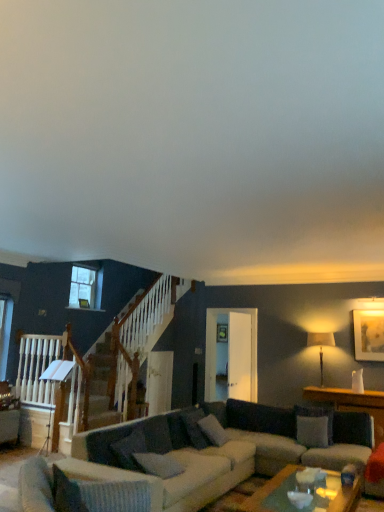
Question: Considering the relative sizes of wooden table at right and gray fabric pillow at center, which is the second pillow from left to right, in the image provided, is wooden table at right smaller than gray fabric pillow at center, which is the second pillow from left to right,?

Choices:
 (A) yes
 (B) no

Answer: (B)

Question: Is wooden table at right not within gray fabric pillow at center, which is counted as the 2th pillow, starting from the front?

Choices:
 (A) yes
 (B) no

Answer: (A)

Question: Considering the relative sizes of wooden table at right and gray fabric pillow at center, which is the second pillow from left to right, in the image provided, is wooden table at right wider than gray fabric pillow at center, which is the second pillow from left to right,?

Choices:
 (A) yes
 (B) no

Answer: (A)

Question: From a real-world perspective, is wooden table at right positioned under gray fabric pillow at center, which is the second pillow from left to right, based on gravity?

Choices:
 (A) no
 (B) yes

Answer: (B)

Question: Is wooden table at right far from gray fabric pillow at center, the 3th pillow from the back?

Choices:
 (A) yes
 (B) no

Answer: (A)

Question: Would you say gray fabric pillow at center, which is the second pillow from left to right, is to the left or to the right of matte gold picture frame at upper right in the picture?

Choices:
 (A) left
 (B) right

Answer: (A)

Question: Is gray fabric pillow at center, which is the second pillow from left to right, bigger or smaller than matte gold picture frame at upper right?

Choices:
 (A) big
 (B) small

Answer: (B)

Question: Would you say gray fabric pillow at center, the 3th pillow from the back, is inside or outside matte gold picture frame at upper right?

Choices:
 (A) outside
 (B) inside

Answer: (A)

Question: From the image's perspective, is gray fabric pillow at center, the 3th pillow from the back, located above or below matte gold picture frame at upper right?

Choices:
 (A) below
 (B) above

Answer: (A)

Question: Is gray fabric pillow at center, the 3th pillow from the back, situated inside textured gray couch at center or outside?

Choices:
 (A) inside
 (B) outside

Answer: (A)

Question: Looking at the image, does gray fabric pillow at center, the 3th pillow from the back, seem bigger or smaller compared to textured gray couch at center?

Choices:
 (A) small
 (B) big

Answer: (A)

Question: From their relative heights in the image, would you say gray fabric pillow at center, the 3th pillow viewed from the right, is taller or shorter than textured gray couch at center?

Choices:
 (A) tall
 (B) short

Answer: (B)

Question: Considering the positions of gray fabric pillow at center, which is counted as the 2th pillow, starting from the front, and textured gray couch at center in the image, is gray fabric pillow at center, which is counted as the 2th pillow, starting from the front, wider or thinner than textured gray couch at center?

Choices:
 (A) wide
 (B) thin

Answer: (B)

Question: Based on their sizes in the image, would you say white fabric pillow at center, which ranks as the 1th pillow in right-to-left order, is bigger or smaller than clear glass window at upper left?

Choices:
 (A) big
 (B) small

Answer: (A)

Question: Is white fabric pillow at center, which is the 1th pillow in back-to-front order, spatially inside clear glass window at upper left, or outside of it?

Choices:
 (A) outside
 (B) inside

Answer: (A)